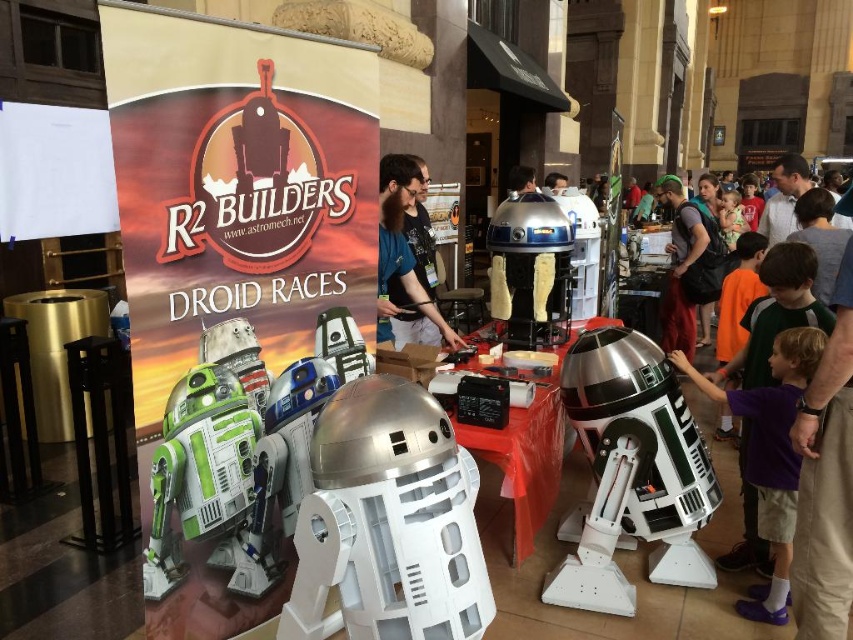
In the scene shown: Which of these two, satin silver robot at center or purple cotton shirt at center, stands taller?

purple cotton shirt at center is taller.

Does satin silver robot at center appear over purple cotton shirt at center?

No.

I want to click on satin silver robot at center, so click(x=633, y=468).

Is purple cotton shirt at center positioned at the back of metallic blue droid at center?

No.

Which is more to the right, purple cotton shirt at center or metallic blue droid at center?

purple cotton shirt at center is more to the right.

Who is more distant from viewer, (786, 509) or (531, 300)?

The point (531, 300) is more distant.

You are a GUI agent. You are given a task and a screenshot of the screen. Output one action in this format:
    pyautogui.click(x=<x>, y=<y>)
    Task: Click on the purple cotton shirt at center
    This screenshot has width=853, height=640.
    Given the screenshot: What is the action you would take?
    pyautogui.click(x=770, y=452)

Which is behind, point (170, 438) or point (514, 216)?

Positioned behind is point (514, 216).

I want to click on green matte r2-d2 at center, so [x=201, y=474].